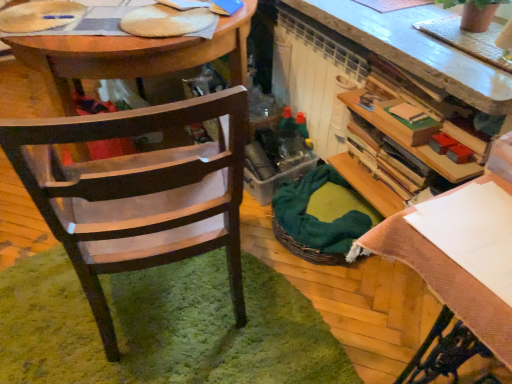
Question: Is green woven picnic basket at center positioned before terracotta textured pot at upper right?

Choices:
 (A) no
 (B) yes

Answer: (A)

Question: Is green woven picnic basket at center wider than terracotta textured pot at upper right?

Choices:
 (A) yes
 (B) no

Answer: (A)

Question: Could you tell me if green woven picnic basket at center is facing terracotta textured pot at upper right?

Choices:
 (A) no
 (B) yes

Answer: (A)

Question: From a real-world perspective, is green woven picnic basket at center on terracotta textured pot at upper right?

Choices:
 (A) yes
 (B) no

Answer: (B)

Question: Considering the relative sizes of green woven picnic basket at center and terracotta textured pot at upper right in the image provided, is green woven picnic basket at center smaller than terracotta textured pot at upper right?

Choices:
 (A) yes
 (B) no

Answer: (B)

Question: In the image, is terracotta textured pot at upper right positioned in front of or behind wooden chair at left?

Choices:
 (A) front
 (B) behind

Answer: (B)

Question: Would you say terracotta textured pot at upper right is inside or outside wooden chair at left?

Choices:
 (A) inside
 (B) outside

Answer: (B)

Question: From a real-world perspective, is terracotta textured pot at upper right positioned above or below wooden chair at left?

Choices:
 (A) below
 (B) above

Answer: (B)

Question: Is terracotta textured pot at upper right bigger or smaller than wooden chair at left?

Choices:
 (A) big
 (B) small

Answer: (B)

Question: From the image's perspective, is wooden chair at left located above or below green woven picnic basket at center?

Choices:
 (A) below
 (B) above

Answer: (B)

Question: Is wooden chair at left inside the boundaries of green woven picnic basket at center, or outside?

Choices:
 (A) inside
 (B) outside

Answer: (B)

Question: In the image, is wooden chair at left positioned in front of or behind green woven picnic basket at center?

Choices:
 (A) behind
 (B) front

Answer: (B)

Question: Is wooden chair at left to the left or to the right of green woven picnic basket at center in the image?

Choices:
 (A) right
 (B) left

Answer: (B)

Question: Does point (32, 36) appear closer or farther from the camera than point (342, 263)?

Choices:
 (A) farther
 (B) closer

Answer: (B)

Question: Looking at their shapes, would you say wooden desk at center is wider or thinner than green woven picnic basket at center?

Choices:
 (A) thin
 (B) wide

Answer: (B)